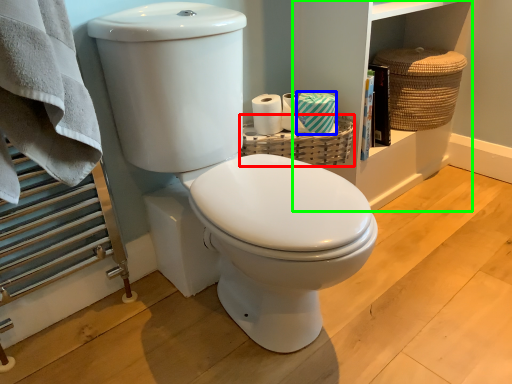
Question: Considering the real-world distances, which object is closest to basket (highlighted by a red box)? toilet paper (highlighted by a blue box) or bookshelf (highlighted by a green box).

Choices:
 (A) toilet paper
 (B) bookshelf

Answer: (A)